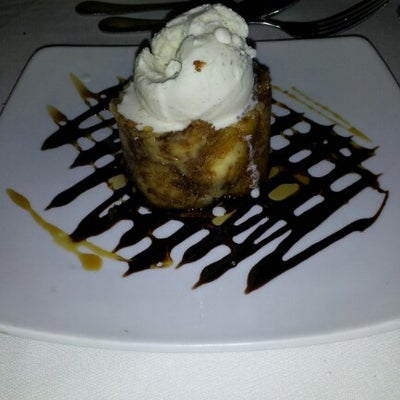
I want to click on table to left of plate, so pos(10,69).